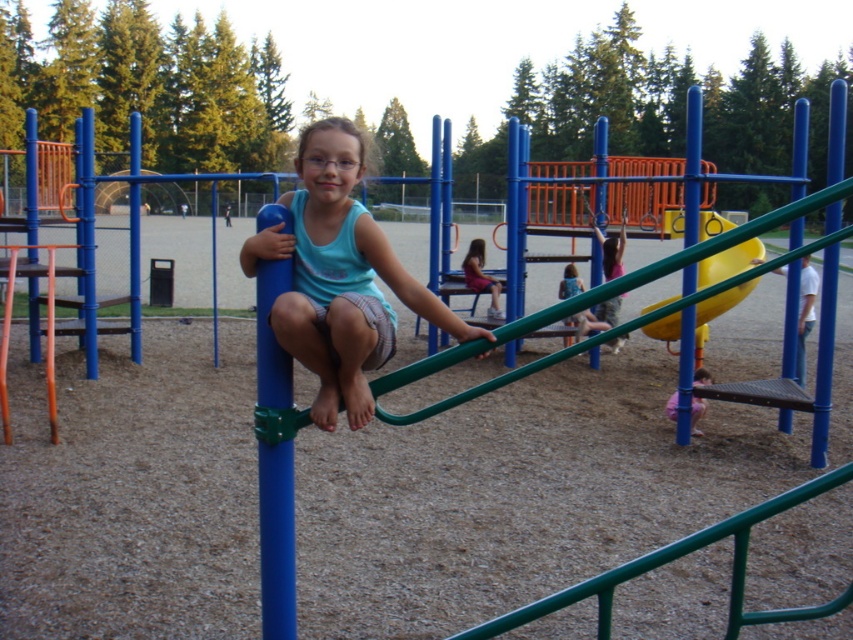
Question: Does yellow rubber slide at center come behind blue glossy pole at upper right?

Choices:
 (A) no
 (B) yes

Answer: (B)

Question: Among these objects, which one is farthest from the camera?

Choices:
 (A) blue glossy pole at upper right
 (B) matte blue tank top at center
 (C) yellow rubber slide at center
 (D) matte pink dress at center

Answer: (D)

Question: Is matte pink dress at center to the left of matte blue shorts at center from the viewer's perspective?

Choices:
 (A) no
 (B) yes

Answer: (B)

Question: Which object appears farthest from the camera in this image?

Choices:
 (A) matte blue tank top at center
 (B) blue glossy pole at upper right
 (C) yellow rubber slide at center
 (D) blue rubber pole at center

Answer: (C)

Question: Which point is farther from the camera taking this photo?

Choices:
 (A) (613, 324)
 (B) (659, 336)

Answer: (A)

Question: Considering the relative positions of yellow rubber slide at center and pink fabric pants at lower right in the image provided, where is yellow rubber slide at center located with respect to pink fabric pants at lower right?

Choices:
 (A) above
 (B) below

Answer: (A)